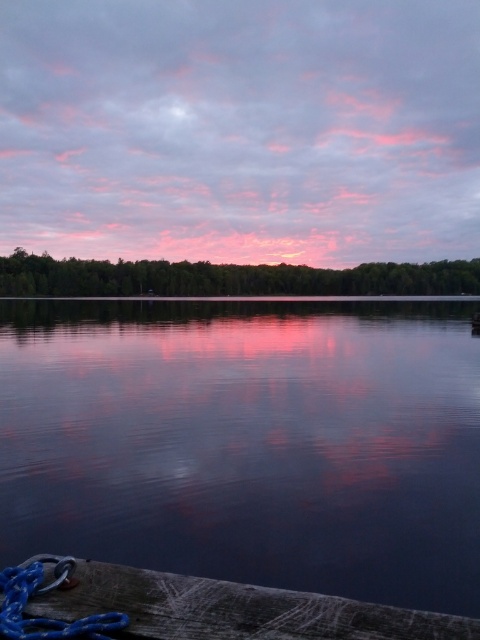
Can you confirm if smooth water at center is bigger than blue wood at lower left?

Yes.

Measure the distance between smooth water at center and blue wood at lower left.

A distance of 15.34 meters exists between smooth water at center and blue wood at lower left.

Describe the element at coordinates (248, 442) in the screenshot. I see `smooth water at center` at that location.

Identify the location of smooth water at center. The width and height of the screenshot is (480, 640). (248, 442).

Between smooth water at center and blue rubber rope at lower left, which one has less height?

Standing shorter between the two is blue rubber rope at lower left.

Does smooth water at center appear over blue rubber rope at lower left?

Yes, smooth water at center is above blue rubber rope at lower left.

What are the coordinates of `smooth water at center` in the screenshot? It's located at (248, 442).

Where is `smooth water at center`? The image size is (480, 640). smooth water at center is located at coordinates pos(248,442).

Between blue wood at lower left and blue rubber rope at lower left, which one is positioned lower?

Positioned lower is blue wood at lower left.

Is the position of blue wood at lower left more distant than that of blue rubber rope at lower left?

That is True.

Locate an element on the screen. The image size is (480, 640). blue wood at lower left is located at coordinates 192,608.

The height and width of the screenshot is (640, 480). In order to click on blue wood at lower left in this screenshot , I will do `click(192, 608)`.